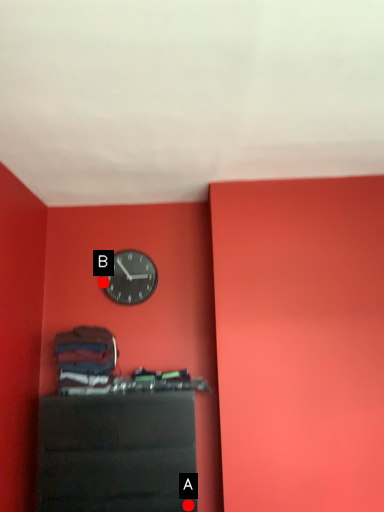
Question: Two points are circled on the image, labeled by A and B beside each circle. Which point appears farthest from the camera in this image?

Choices:
 (A) A is further
 (B) B is further

Answer: (B)